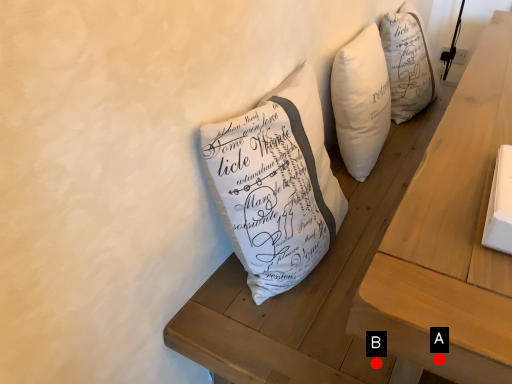
Question: Two points are circled on the image, labeled by A and B beside each circle. Which of the following is the closest to the observer?

Choices:
 (A) A is closer
 (B) B is closer

Answer: (A)